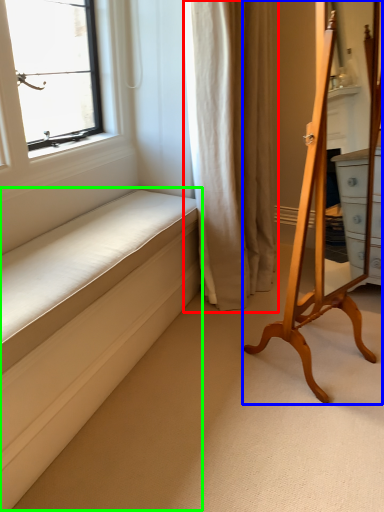
Question: Based on their relative distances, which object is nearer to curtain (highlighted by a red box)? Choose from furniture (highlighted by a blue box) and bed frame (highlighted by a green box).

Choices:
 (A) furniture
 (B) bed frame

Answer: (A)